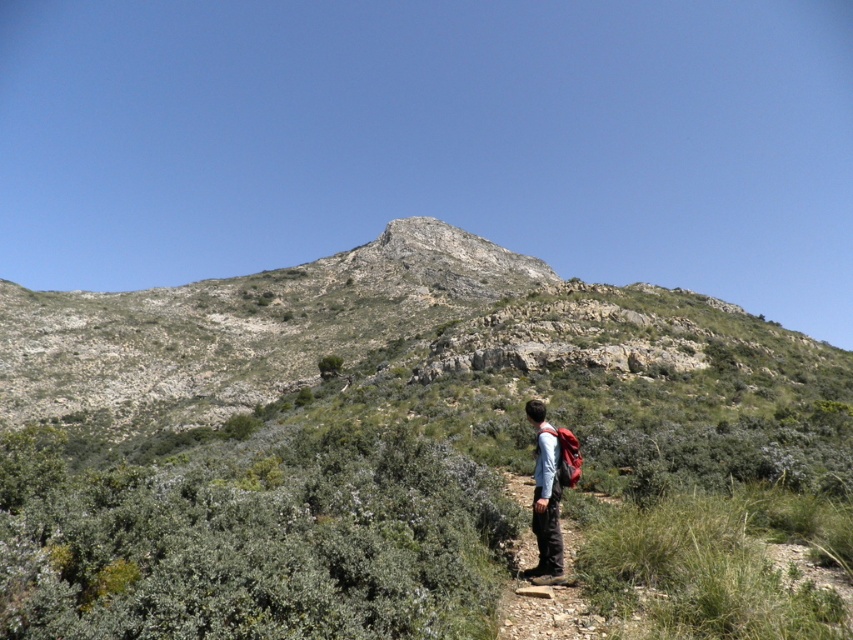
You are a photographer planning to take a landscape photo of the rugged stone mountain at center and the matte blue shirt at center. Which object should you focus on first if you want to capture both in a single frame without moving the camera?

The rugged stone mountain at center is bigger than the matte blue shirt at center, so you should focus on the rugged stone mountain at center first to ensure it fills the frame appropriately before adjusting for the smaller matte blue shirt at center.

You are a photographer planning to capture the rugged stone mountain at center and the matte blue shirt at center in a single frame. Based on the scene, which object would appear larger in the photo?

The rugged stone mountain at center would appear larger in the photo because it is wider than the matte blue shirt at center.